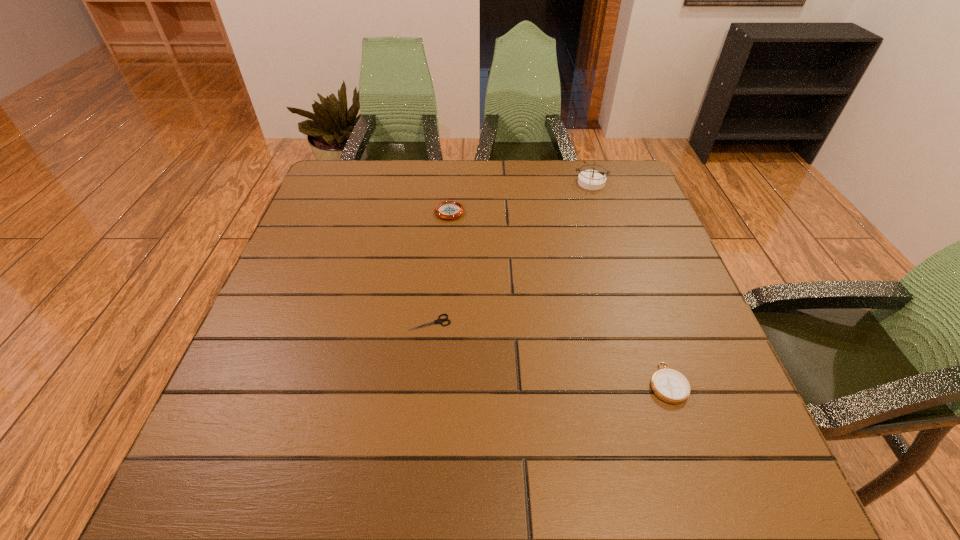
Where is `vacant space situated on the front of the second nearest object`? vacant space situated on the front of the second nearest object is located at coordinates (425, 367).

The image size is (960, 540). What are the coordinates of `object that is at the far right corner` in the screenshot? It's located at (589, 179).

In the image, there is a desktop. In order to click on vacant space at the far edge in this screenshot , I will do `click(463, 197)`.

Locate an element on the screen. This screenshot has height=540, width=960. vacant space at the near edge of the desktop is located at coordinates (547, 487).

Image resolution: width=960 pixels, height=540 pixels. Find the location of `vacant region at the left edge`. vacant region at the left edge is located at coordinates (248, 341).

I want to click on vacant space at the right edge of the desktop, so click(x=653, y=241).

Where is `free spot at the far right corner of the desktop`? The height and width of the screenshot is (540, 960). free spot at the far right corner of the desktop is located at coordinates (610, 192).

Locate an element on the screen. This screenshot has height=540, width=960. blank region between the third farthest object and the nearest compass is located at coordinates (549, 353).

Identify the location of free point between the nearest compass and the shears. (549, 353).

Where is `empty location between the tallest compass and the nearest object`? The width and height of the screenshot is (960, 540). empty location between the tallest compass and the nearest object is located at coordinates (629, 283).